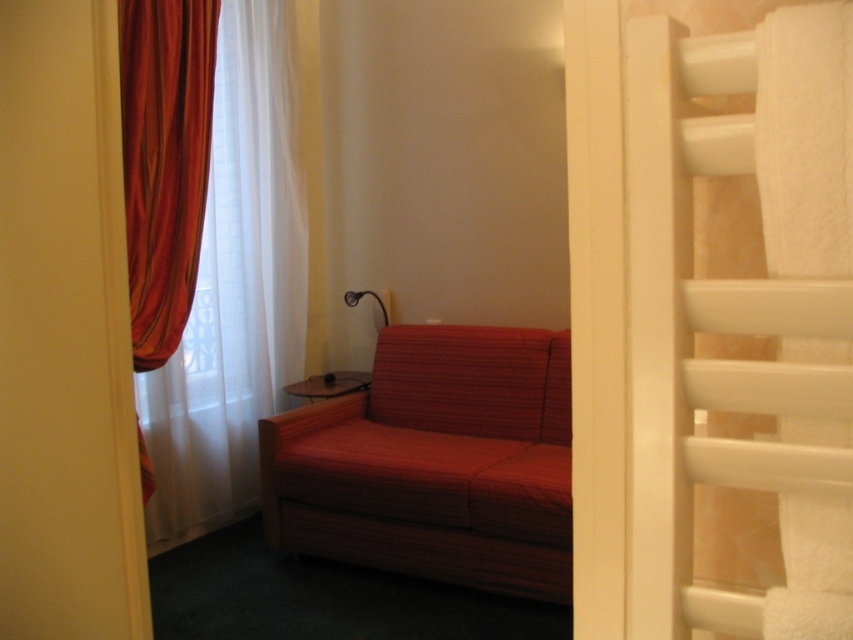
Who is more distant from viewer, [376,525] or [143,54]?

The point [143,54] is more distant.

Is point (416, 353) in front of point (210, 42)?

No.

The width and height of the screenshot is (853, 640). Find the location of `red fabric couch at lower left`. red fabric couch at lower left is located at coordinates (430, 465).

Does velvet orange curtain at left have a greater height compared to velvet-like red curtain at left?

Indeed, velvet orange curtain at left has a greater height compared to velvet-like red curtain at left.

Does point (213, 221) come farther from viewer compared to point (132, 81)?

Yes, point (213, 221) is behind point (132, 81).

Locate an element on the screen. The width and height of the screenshot is (853, 640). velvet orange curtain at left is located at coordinates (234, 289).

Is velvet orange curtain at left shorter than metallic black lamp at upper center?

Incorrect, velvet orange curtain at left's height does not fall short of metallic black lamp at upper center's.

Between velvet orange curtain at left and metallic black lamp at upper center, which one appears on the left side from the viewer's perspective?

Positioned to the left is velvet orange curtain at left.

What are the coordinates of `velvet orange curtain at left` in the screenshot? It's located at (234, 289).